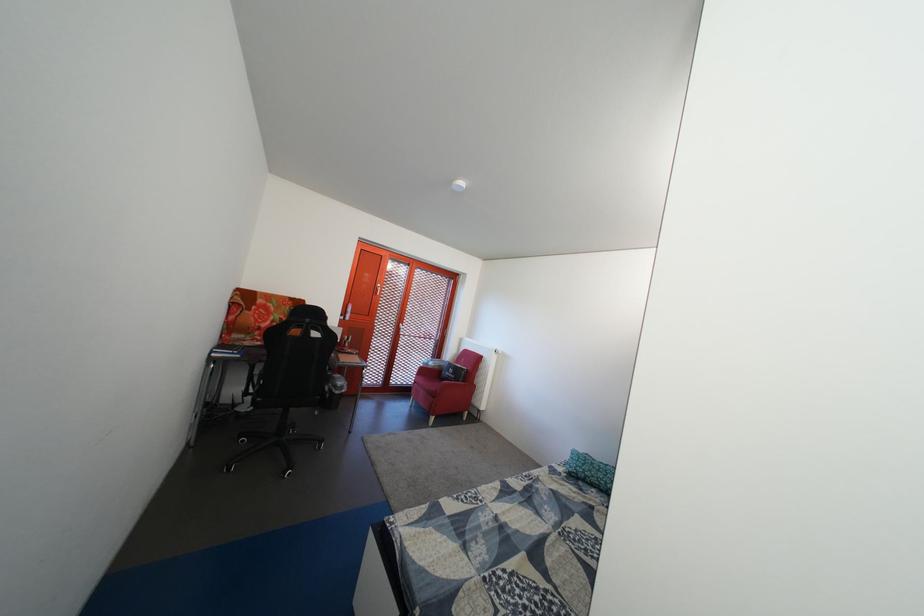
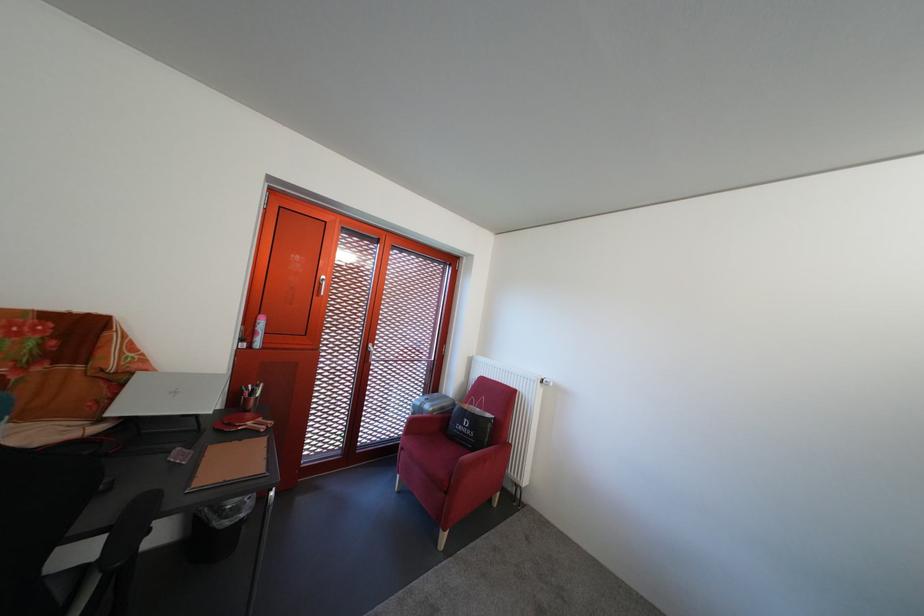
In the second image, find the point that corresponds to (426,389) in the first image.

(412, 456)